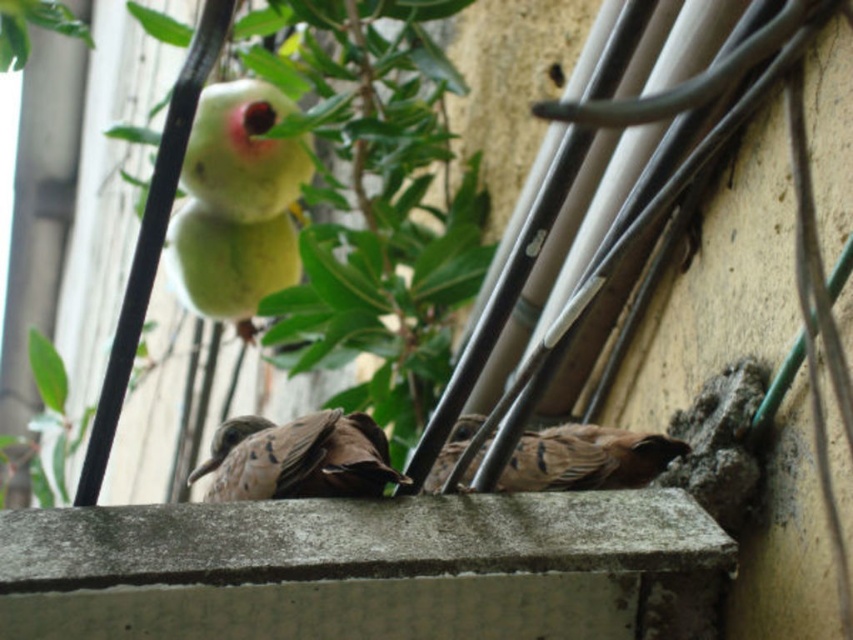
Question: Which object appears closest to the camera in this image?

Choices:
 (A) brown speckled feathers at center
 (B) brown feathered bird at center

Answer: (B)

Question: In this image, where is brown feathered bird at center located relative to brown speckled feathers at center?

Choices:
 (A) below
 (B) above

Answer: (A)

Question: Is brown feathered bird at center thinner than brown speckled feathers at center?

Choices:
 (A) no
 (B) yes

Answer: (B)

Question: Which object is closer to the camera taking this photo?

Choices:
 (A) brown feathered bird at center
 (B) brown speckled feathers at center

Answer: (A)

Question: Is brown feathered bird at center smaller than brown speckled feathers at center?

Choices:
 (A) no
 (B) yes

Answer: (B)